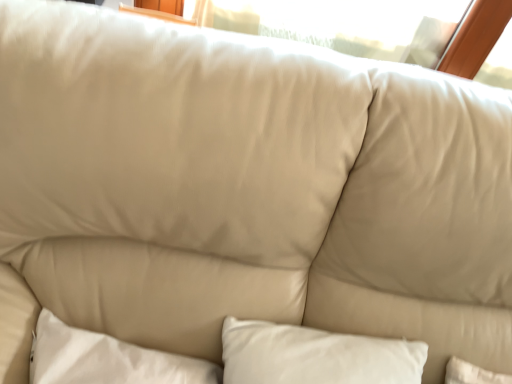
Measure the distance between white soft pillow at lower center and camera.

The distance of white soft pillow at lower center from camera is 26.57 inches.

Describe the element at coordinates (315, 355) in the screenshot. I see `white soft pillow at lower center` at that location.

Where is `white soft pillow at lower center`? This screenshot has height=384, width=512. white soft pillow at lower center is located at coordinates (315, 355).

You are a GUI agent. You are given a task and a screenshot of the screen. Output one action in this format:
    pyautogui.click(x=<x>, y=<y>)
    Task: Click on the white soft pillow at lower center
    This screenshot has width=512, height=384.
    Given the screenshot: What is the action you would take?
    pyautogui.click(x=315, y=355)